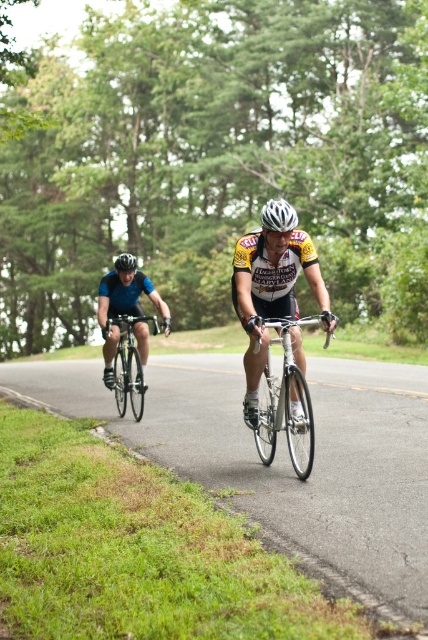
Who is positioned more to the left, shiny silver bicycle at left or black matte helmet at upper center?

black matte helmet at upper center is more to the left.

Can you confirm if shiny silver bicycle at left is shorter than black matte helmet at upper center?

Correct, shiny silver bicycle at left is not as tall as black matte helmet at upper center.

Who is more forward, (x=133, y=392) or (x=121, y=268)?

Point (x=133, y=392) is more forward.

At what (x,y) coordinates should I click in order to perform the action: click on shiny silver bicycle at left. Please return your answer as a coordinate pair (x, y). The width and height of the screenshot is (428, 640). Looking at the image, I should click on (130, 364).

Does silver metallic bicycle at center appear under white matte bicycle helmet at center?

Yes.

Can you confirm if silver metallic bicycle at center is bigger than white matte bicycle helmet at center?

Indeed, silver metallic bicycle at center has a larger size compared to white matte bicycle helmet at center.

Where is `silver metallic bicycle at center`? Image resolution: width=428 pixels, height=640 pixels. silver metallic bicycle at center is located at coordinates (287, 401).

Does white matte bicycle helmet at center have a lesser height compared to black matte helmet at upper center?

Indeed, white matte bicycle helmet at center has a lesser height compared to black matte helmet at upper center.

This screenshot has height=640, width=428. Describe the element at coordinates (279, 216) in the screenshot. I see `white matte bicycle helmet at center` at that location.

This screenshot has width=428, height=640. What are the coordinates of `white matte bicycle helmet at center` in the screenshot? It's located at (279, 216).